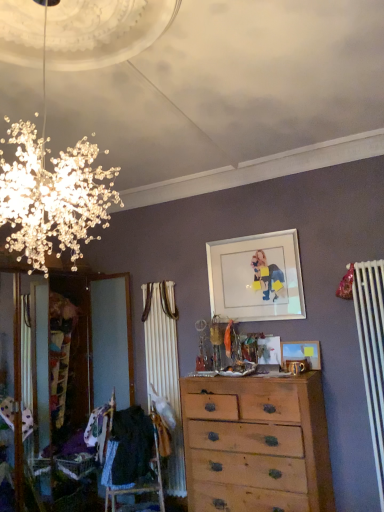
Describe the element at coordinates (256, 444) in the screenshot. I see `light brown wooden chest of drawers at center` at that location.

Find the location of `black fabric at lower left`. black fabric at lower left is located at coordinates (128, 448).

Measure the distance between wooden picture frame at center, the 1th picture frame ordered from the bottom, and camera.

wooden picture frame at center, the 1th picture frame ordered from the bottom, is 3.45 meters from camera.

Identify the location of light brown wooden chest of drawers at center. This screenshot has width=384, height=512. (256, 444).

Could you measure the distance between black fabric at lower left and white glossy picture frame at upper center, the second picture frame in the bottom-to-top sequence?

The distance of black fabric at lower left from white glossy picture frame at upper center, the second picture frame in the bottom-to-top sequence, is 1.46 meters.

From the image's perspective, which object appears higher, black fabric at lower left or white glossy picture frame at upper center, the 1th picture frame from the top?

white glossy picture frame at upper center, the 1th picture frame from the top, from the image's perspective.

Is black fabric at lower left thinner than white glossy picture frame at upper center, the second picture frame in the bottom-to-top sequence?

No, black fabric at lower left is not thinner than white glossy picture frame at upper center, the second picture frame in the bottom-to-top sequence.

Which is farther from the camera, (113, 461) or (225, 283)?

The point (225, 283) is farther.

From the image's perspective, is black fabric at lower left located above or below light brown wooden chest of drawers at center?

black fabric at lower left is above light brown wooden chest of drawers at center.

Considering the sizes of objects black fabric at lower left and light brown wooden chest of drawers at center in the image provided, who is smaller, black fabric at lower left or light brown wooden chest of drawers at center?

Smaller between the two is black fabric at lower left.

From the picture: From a real-world perspective, who is located higher, black fabric at lower left or light brown wooden chest of drawers at center?

black fabric at lower left.

In order to click on chest of drawers on the right of black fabric at lower left in this screenshot , I will do `click(256, 444)`.

From the picture: Is light brown wooden chest of drawers at center positioned far away from wooden picture frame at center, the 2th picture frame viewed from the top?

No, light brown wooden chest of drawers at center is in close proximity to wooden picture frame at center, the 2th picture frame viewed from the top.

From the image's perspective, is light brown wooden chest of drawers at center above or below wooden picture frame at center, the 2th picture frame viewed from the top?

light brown wooden chest of drawers at center is situated lower than wooden picture frame at center, the 2th picture frame viewed from the top, in the image.

Considering the points (263, 451) and (317, 354), which point is behind, point (263, 451) or point (317, 354)?

The point (317, 354) is farther.

Where is `the 2nd picture frame to the right of the light brown wooden chest of drawers at center, starting your count from the anchor`? The width and height of the screenshot is (384, 512). the 2nd picture frame to the right of the light brown wooden chest of drawers at center, starting your count from the anchor is located at coordinates (301, 353).

Who is shorter, black fabric at lower left or wooden picture frame at center, the 1th picture frame ordered from the bottom?

wooden picture frame at center, the 1th picture frame ordered from the bottom.

Would you say black fabric at lower left contains wooden picture frame at center, the 1th picture frame ordered from the bottom?

No, black fabric at lower left does not contain wooden picture frame at center, the 1th picture frame ordered from the bottom.

What's the angular difference between black fabric at lower left and wooden picture frame at center, the 2th picture frame viewed from the top,'s facing directions?

The angle between the facing direction of black fabric at lower left and the facing direction of wooden picture frame at center, the 2th picture frame viewed from the top, is 29.3 degrees.

Considering the relative positions of black fabric at lower left and wooden picture frame at center, the 2th picture frame viewed from the top, in the image provided, is black fabric at lower left to the right of wooden picture frame at center, the 2th picture frame viewed from the top, from the viewer's perspective?

Incorrect, black fabric at lower left is not on the right side of wooden picture frame at center, the 2th picture frame viewed from the top.

Would you consider light brown wooden chest of drawers at center to be distant from white glossy picture frame at upper center, the 1th picture frame from the top?

Yes, light brown wooden chest of drawers at center is far from white glossy picture frame at upper center, the 1th picture frame from the top.

Which of these two, light brown wooden chest of drawers at center or white glossy picture frame at upper center, the second picture frame in the bottom-to-top sequence, is wider?

light brown wooden chest of drawers at center is wider.

From the image's perspective, which is above, light brown wooden chest of drawers at center or white glossy picture frame at upper center, the second picture frame in the bottom-to-top sequence?

white glossy picture frame at upper center, the second picture frame in the bottom-to-top sequence, from the image's perspective.

There is a light brown wooden chest of drawers at center. Where is `the 2nd picture frame above it (from a real-world perspective)`? Image resolution: width=384 pixels, height=512 pixels. the 2nd picture frame above it (from a real-world perspective) is located at coordinates (256, 278).

Considering the positions of objects wooden picture frame at center, the 1th picture frame ordered from the bottom, and white glossy picture frame at upper center, the second picture frame in the bottom-to-top sequence, in the image provided, who is more to the left, wooden picture frame at center, the 1th picture frame ordered from the bottom, or white glossy picture frame at upper center, the second picture frame in the bottom-to-top sequence,?

From the viewer's perspective, white glossy picture frame at upper center, the second picture frame in the bottom-to-top sequence, appears more on the left side.

From the image's perspective, which one is positioned higher, wooden picture frame at center, the 2th picture frame viewed from the top, or white glossy picture frame at upper center, the second picture frame in the bottom-to-top sequence?

white glossy picture frame at upper center, the second picture frame in the bottom-to-top sequence, from the image's perspective.

Who is bigger, wooden picture frame at center, the 2th picture frame viewed from the top, or white glossy picture frame at upper center, the 1th picture frame from the top?

white glossy picture frame at upper center, the 1th picture frame from the top, is bigger.

Based on the photo, is light brown wooden chest of drawers at center surrounded by white glossy picture frame at upper center, the second picture frame in the bottom-to-top sequence?

No.

Locate an element on the screen. This screenshot has height=512, width=384. chest of drawers below the white glossy picture frame at upper center, the 1th picture frame from the top (from the image's perspective) is located at coordinates (256, 444).

Considering the sizes of white glossy picture frame at upper center, the second picture frame in the bottom-to-top sequence, and light brown wooden chest of drawers at center in the image, is white glossy picture frame at upper center, the second picture frame in the bottom-to-top sequence, taller or shorter than light brown wooden chest of drawers at center?

In the image, white glossy picture frame at upper center, the second picture frame in the bottom-to-top sequence, appears to be shorter than light brown wooden chest of drawers at center.

This screenshot has width=384, height=512. In order to click on clothing below the white glossy picture frame at upper center, the 1th picture frame from the top (from the image's perspective) in this screenshot , I will do `click(128, 448)`.

The width and height of the screenshot is (384, 512). I want to click on clothing that appears on the left of light brown wooden chest of drawers at center, so click(128, 448).

When comparing their distances from wooden picture frame at center, the 1th picture frame ordered from the bottom, does white glossy picture frame at upper center, the second picture frame in the bottom-to-top sequence, or black fabric at lower left seem further?

black fabric at lower left.

From the image, which object appears to be nearer to black fabric at lower left, light brown wooden chest of drawers at center or white glossy picture frame at upper center, the second picture frame in the bottom-to-top sequence?

light brown wooden chest of drawers at center lies closer to black fabric at lower left than the other object.

Estimate the real-world distances between objects in this image. Which object is closer to light brown wooden chest of drawers at center, black fabric at lower left or white glossy picture frame at upper center, the second picture frame in the bottom-to-top sequence?

black fabric at lower left.

Considering their positions, is wooden picture frame at center, the 2th picture frame viewed from the top, positioned closer to white glossy picture frame at upper center, the 1th picture frame from the top, than black fabric at lower left?

Based on the image, wooden picture frame at center, the 2th picture frame viewed from the top, appears to be nearer to white glossy picture frame at upper center, the 1th picture frame from the top.

When comparing their distances from black fabric at lower left, does white glossy picture frame at upper center, the 1th picture frame from the top, or wooden picture frame at center, the 2th picture frame viewed from the top, seem further?

white glossy picture frame at upper center, the 1th picture frame from the top, is positioned further to the anchor black fabric at lower left.

In the scene shown: From the image, which object appears to be nearer to white glossy picture frame at upper center, the second picture frame in the bottom-to-top sequence, wooden picture frame at center, the 1th picture frame ordered from the bottom, or light brown wooden chest of drawers at center?

wooden picture frame at center, the 1th picture frame ordered from the bottom, is positioned closer to the anchor white glossy picture frame at upper center, the second picture frame in the bottom-to-top sequence.

Looking at the image, which one is located closer to wooden picture frame at center, the 2th picture frame viewed from the top, black fabric at lower left or white glossy picture frame at upper center, the 1th picture frame from the top?

white glossy picture frame at upper center, the 1th picture frame from the top, lies closer to wooden picture frame at center, the 2th picture frame viewed from the top, than the other object.

Estimate the real-world distances between objects in this image. Which object is closer to wooden picture frame at center, the 1th picture frame ordered from the bottom, white glossy picture frame at upper center, the second picture frame in the bottom-to-top sequence, or light brown wooden chest of drawers at center?

white glossy picture frame at upper center, the second picture frame in the bottom-to-top sequence, is positioned closer to the anchor wooden picture frame at center, the 1th picture frame ordered from the bottom.

Where is `clothing that lies between white glossy picture frame at upper center, the second picture frame in the bottom-to-top sequence, and light brown wooden chest of drawers at center from top to bottom`? This screenshot has width=384, height=512. clothing that lies between white glossy picture frame at upper center, the second picture frame in the bottom-to-top sequence, and light brown wooden chest of drawers at center from top to bottom is located at coordinates (128, 448).

Find the location of a particular element. picture frame between white glossy picture frame at upper center, the second picture frame in the bottom-to-top sequence, and light brown wooden chest of drawers at center from top to bottom is located at coordinates (301, 353).

Locate an element on the screen. The image size is (384, 512). picture frame between black fabric at lower left and wooden picture frame at center, the 2th picture frame viewed from the top, from left to right is located at coordinates (256, 278).

Where is `the chest of drawers situated between black fabric at lower left and wooden picture frame at center, the 2th picture frame viewed from the top, from left to right`? the chest of drawers situated between black fabric at lower left and wooden picture frame at center, the 2th picture frame viewed from the top, from left to right is located at coordinates (256, 444).